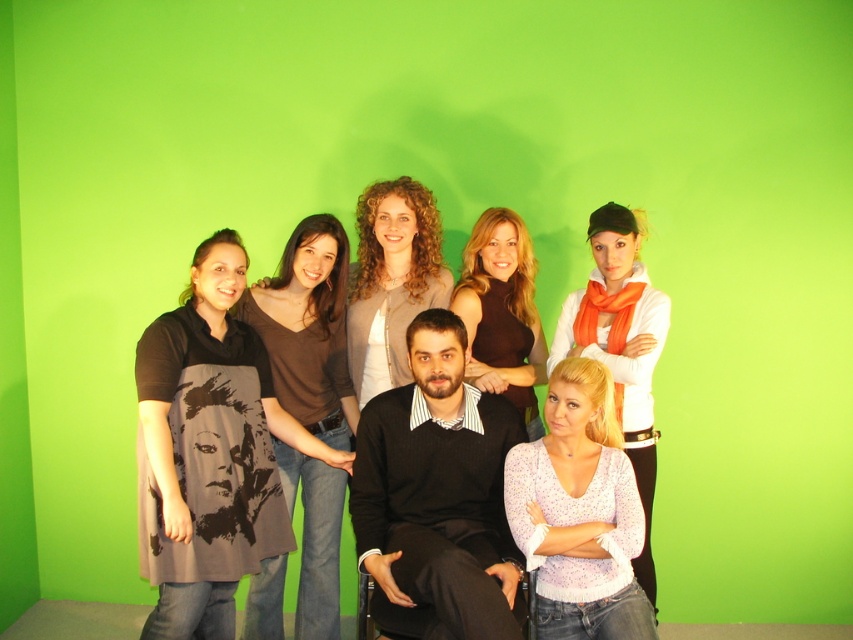
Question: Which point is farther from the camera taking this photo?

Choices:
 (A) (323, 358)
 (B) (467, 412)

Answer: (A)

Question: Can you confirm if light purple knit sweater at center is positioned to the left of light beige sweater at center?

Choices:
 (A) yes
 (B) no

Answer: (B)

Question: Estimate the real-world distances between objects in this image. Which object is closer to the dark brown jersey at center?

Choices:
 (A) black sweater at center
 (B) matte brown sweater at center

Answer: (B)

Question: Where is black sweater at center located in relation to white knit sweater at center in the image?

Choices:
 (A) below
 (B) above

Answer: (A)

Question: Estimate the real-world distances between objects in this image. Which object is farther from the black sweater at center?

Choices:
 (A) dark brown jersey at center
 (B) matte brown sweater at center
 (C) light beige sweater at center

Answer: (C)

Question: Is dark brown jersey at center smaller than light beige sweater at center?

Choices:
 (A) yes
 (B) no

Answer: (B)